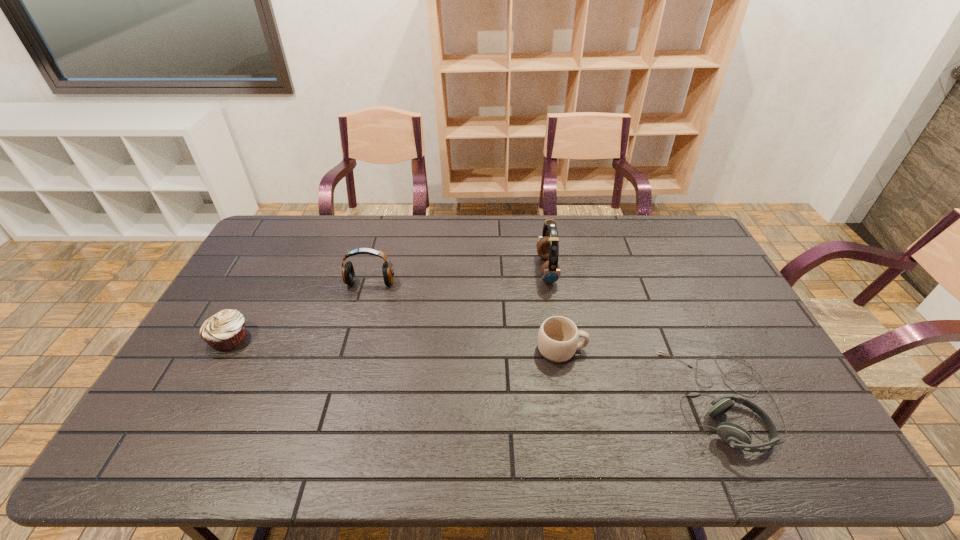
Locate which headset ranks second in proximity to the second object from left to right. Please provide its 2D coordinates. Your answer should be formatted as a tuple, i.e. [(x, y)], where the tuple contains the x and y coordinates of a point satisfying the conditions above.

[(737, 437)]

Image resolution: width=960 pixels, height=540 pixels. I want to click on headset that is the second closest one to the tallest object, so click(348, 274).